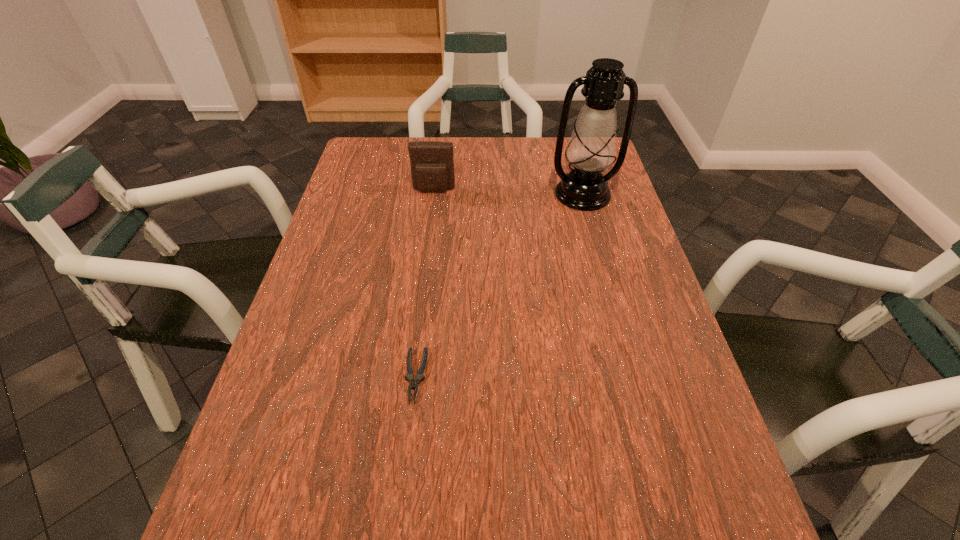
The image size is (960, 540). In the image, there is a desktop. In order to click on vacant space at the left edge in this screenshot , I will do [x=373, y=226].

You are a GUI agent. You are given a task and a screenshot of the screen. Output one action in this format:
    pyautogui.click(x=<x>, y=<y>)
    Task: Click on the vacant space at the right edge of the desktop
    Image resolution: width=960 pixels, height=540 pixels.
    Given the screenshot: What is the action you would take?
    pyautogui.click(x=602, y=309)

You are a GUI agent. You are given a task and a screenshot of the screen. Output one action in this format:
    pyautogui.click(x=<x>, y=<y>)
    Task: Click on the vacant space at the far left corner
    The height and width of the screenshot is (540, 960).
    Given the screenshot: What is the action you would take?
    pyautogui.click(x=352, y=168)

You are a GUI agent. You are given a task and a screenshot of the screen. Output one action in this format:
    pyautogui.click(x=<x>, y=<y>)
    Task: Click on the free space between the pouch and the shortest object
    The width and height of the screenshot is (960, 540).
    Given the screenshot: What is the action you would take?
    pyautogui.click(x=424, y=284)

This screenshot has height=540, width=960. I want to click on unoccupied area between the tallest object and the shortest object, so click(x=499, y=285).

Identify the location of empty location between the pliers and the tallest object. This screenshot has width=960, height=540. (499, 285).

Identify the location of free space between the tallest object and the pliers. (499, 285).

Where is `blank region between the oil lamp and the second tallest object`? blank region between the oil lamp and the second tallest object is located at coordinates (508, 192).

Find the location of a particular element. The image size is (960, 540). vacant space that is in between the pliers and the pouch is located at coordinates (424, 284).

Identify the location of empty location between the rightmost object and the nearest object. The image size is (960, 540). point(499,285).